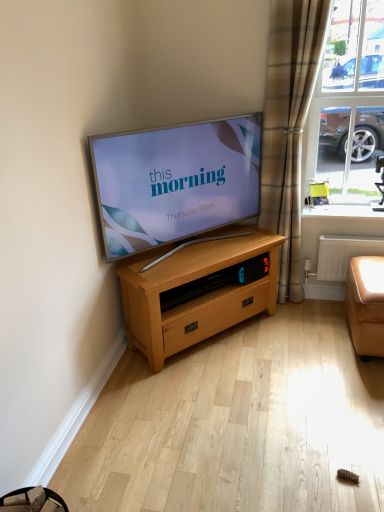
The width and height of the screenshot is (384, 512). Identify the location of vacant region in front of light oak wooden chest of drawers at center. (228, 400).